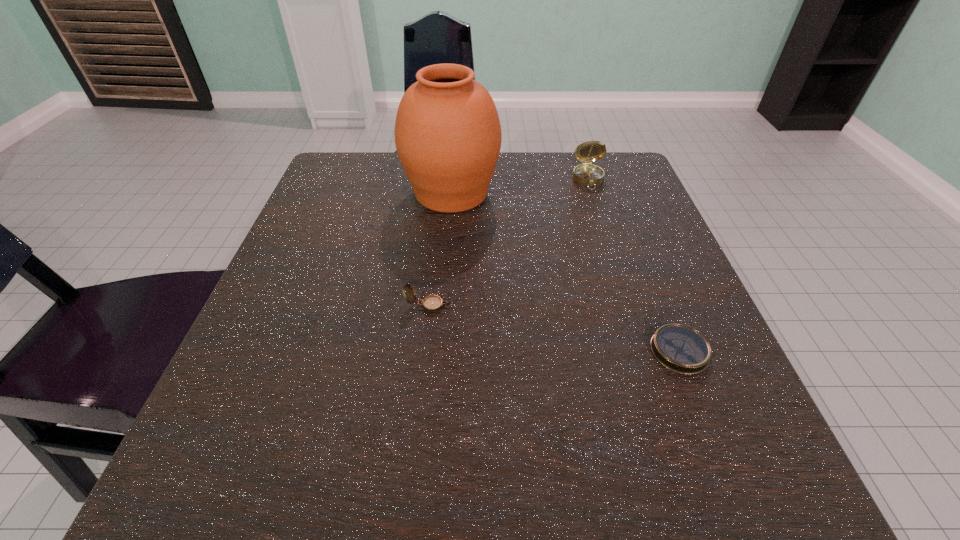
In order to click on object identified as the second closest to the third tallest object in this screenshot , I will do `click(679, 348)`.

Where is `the second closest compass to the second farthest compass`? the second closest compass to the second farthest compass is located at coordinates (586, 174).

Image resolution: width=960 pixels, height=540 pixels. What are the coordinates of `compass that is the closest to the shortest object` in the screenshot? It's located at (432, 303).

At what (x,y) coordinates should I click in order to perform the action: click on free space that satisfies the following two spatial constraints: 1. on the face of the third farthest object; 2. on the right side of the shortest object. Please return your answer as a coordinate pair (x, y). Looking at the image, I should click on (423, 351).

The height and width of the screenshot is (540, 960). Identify the location of vacant space that satisfies the following two spatial constraints: 1. with the dial facing the nearest compass; 2. on the right side of the tallest compass. (645, 351).

Where is `vacant space that satisfies the following two spatial constraints: 1. with the dial facing the second tallest object; 2. on the face of the third farthest object`? Image resolution: width=960 pixels, height=540 pixels. vacant space that satisfies the following two spatial constraints: 1. with the dial facing the second tallest object; 2. on the face of the third farthest object is located at coordinates (630, 306).

What are the coordinates of `free space that satisfies the following two spatial constraints: 1. with the dial facing the tallest compass; 2. on the face of the second nearest compass` in the screenshot? It's located at (630, 306).

This screenshot has width=960, height=540. What are the coordinates of `vacant space that satisfies the following two spatial constraints: 1. with the dial facing the tallest compass; 2. on the left side of the shortest object` in the screenshot? It's located at (645, 351).

You are a GUI agent. You are given a task and a screenshot of the screen. Output one action in this format:
    pyautogui.click(x=<x>, y=<y>)
    Task: Click on the vacant space that satisfies the following two spatial constraints: 1. with the dial facing the nearest object; 2. on the left side of the farthest compass
    Image resolution: width=960 pixels, height=540 pixels.
    Given the screenshot: What is the action you would take?
    pyautogui.click(x=645, y=351)

The height and width of the screenshot is (540, 960). What are the coordinates of `blank area in the image that satisfies the following two spatial constraints: 1. with the dial facing the farthest compass; 2. on the left side of the shortest object` in the screenshot? It's located at (645, 351).